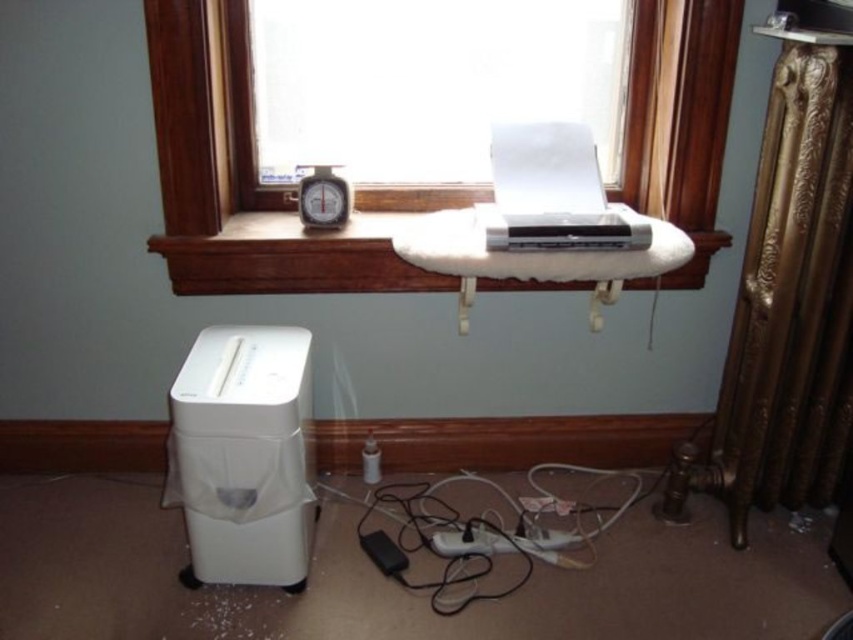
Question: Which of the following is the farthest from the observer?

Choices:
 (A) (248, 460)
 (B) (448, 532)
 (C) (312, 193)

Answer: (B)

Question: In this image, where is white plastic printer at upper center located relative to black plastic alarm clock at center?

Choices:
 (A) right
 (B) left

Answer: (A)

Question: Considering the relative positions of transparent glass window at center and black plastic alarm clock at center in the image provided, where is transparent glass window at center located with respect to black plastic alarm clock at center?

Choices:
 (A) right
 (B) left

Answer: (A)

Question: Which of these objects is positioned farthest from the white plastic shredder at lower left?

Choices:
 (A) black plastic plug at lower center
 (B) transparent glass window at center
 (C) white plastic printer at upper center
 (D) wooden shelf at upper center

Answer: (B)

Question: Among these objects, which one is nearest to the camera?

Choices:
 (A) black plastic plug at lower center
 (B) wooden shelf at upper center
 (C) white plastic shredder at lower left

Answer: (C)

Question: Considering the relative positions of white plastic printer at upper center and black plastic alarm clock at center in the image provided, where is white plastic printer at upper center located with respect to black plastic alarm clock at center?

Choices:
 (A) right
 (B) left

Answer: (A)